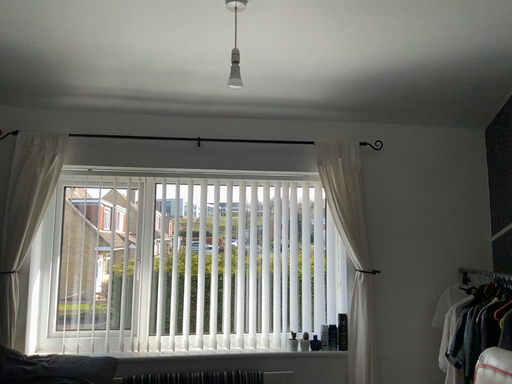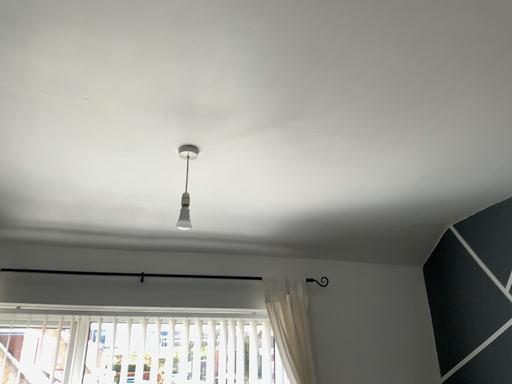
Question: Which way did the camera rotate in the video?

Choices:
 (A) rotated right
 (B) rotated left

Answer: (A)